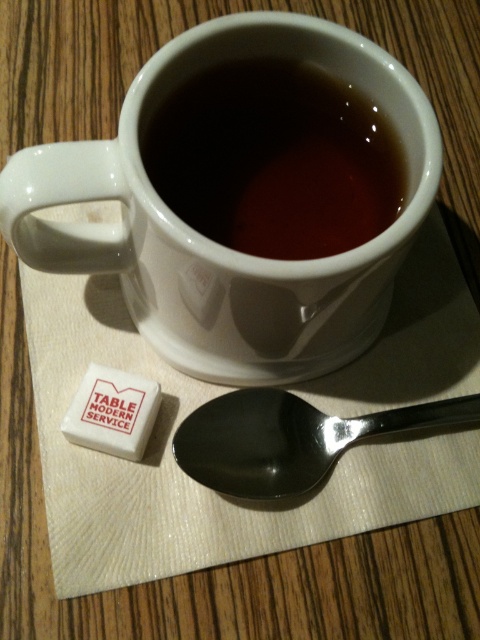
Question: Is the position of white ceramic mug at upper center more distant than that of polished metal spoon at lower center?

Choices:
 (A) no
 (B) yes

Answer: (A)

Question: Is matte ceramic mug at upper center thinner than polished metal spoon at lower center?

Choices:
 (A) no
 (B) yes

Answer: (B)

Question: Which of the following is the closest to the observer?

Choices:
 (A) (319, 288)
 (B) (215, 435)

Answer: (A)

Question: Which point is farther from the camera taking this photo?

Choices:
 (A) (230, 424)
 (B) (166, 116)

Answer: (A)

Question: Can you confirm if white ceramic mug at upper center is positioned to the right of matte ceramic mug at upper center?

Choices:
 (A) no
 (B) yes

Answer: (A)

Question: Which of the following is the closest to the observer?

Choices:
 (A) white ceramic mug at upper center
 (B) polished metal spoon at lower center
 (C) matte ceramic mug at upper center

Answer: (A)